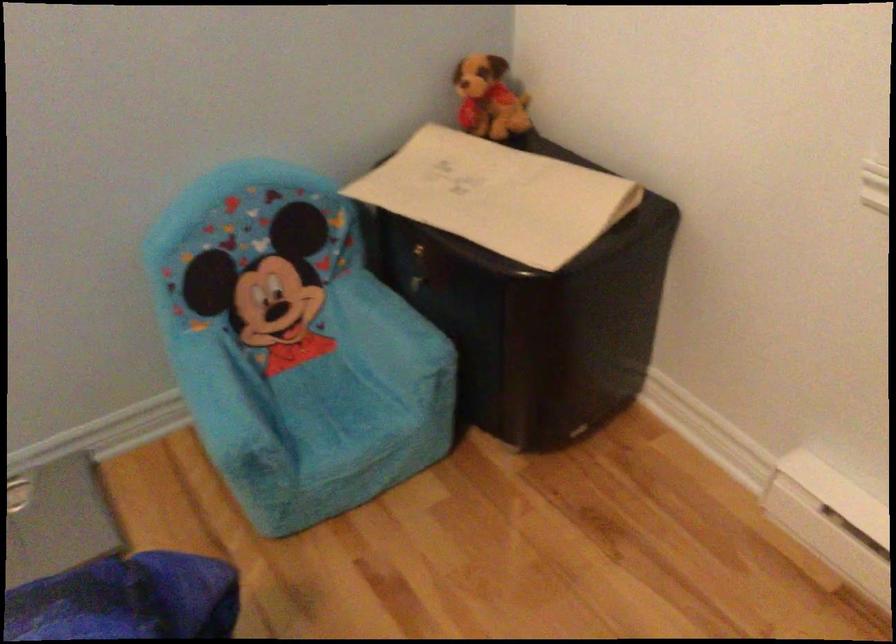
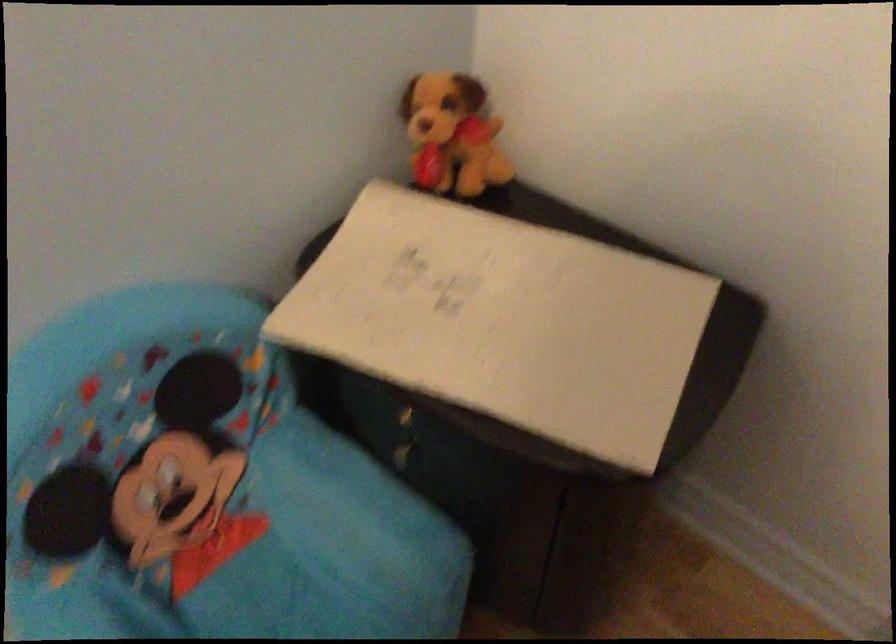
Where in the second image is the point corresponding to the point at 297,361 from the first image?

(220, 554)